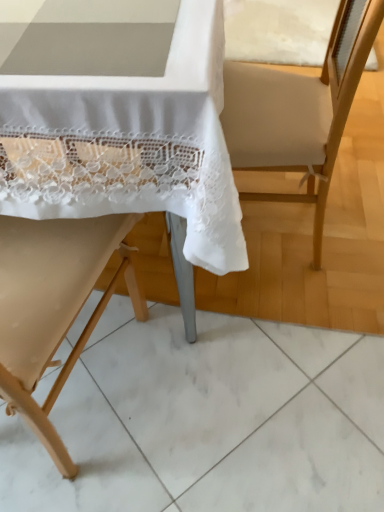
Question: Does beige fabric chair at left, the second chair in the top-to-bottom sequence, have a greater height compared to beige fabric armchair at center?

Choices:
 (A) no
 (B) yes

Answer: (B)

Question: Is beige fabric chair at left, which is counted as the 1th chair, starting from the bottom, positioned behind beige fabric armchair at center?

Choices:
 (A) yes
 (B) no

Answer: (B)

Question: From the image's perspective, is beige fabric chair at left, which is counted as the 1th chair, starting from the bottom, on top of beige fabric armchair at center?

Choices:
 (A) yes
 (B) no

Answer: (B)

Question: Is beige fabric chair at left, the second chair in the top-to-bottom sequence, positioned in front of beige fabric armchair at center?

Choices:
 (A) no
 (B) yes

Answer: (B)

Question: Does beige fabric chair at left, the second chair in the top-to-bottom sequence, have a greater width compared to beige fabric armchair at center?

Choices:
 (A) yes
 (B) no

Answer: (A)

Question: Is beige fabric chair at left, which is counted as the 1th chair, starting from the bottom, completely or partially outside of beige fabric armchair at center?

Choices:
 (A) no
 (B) yes

Answer: (B)

Question: From the image's perspective, is beige wood chair at center, which appears as the 1th chair when viewed from the top, located above beige fabric armchair at center?

Choices:
 (A) no
 (B) yes

Answer: (B)

Question: From a real-world perspective, is beige wood chair at center, positioned as the second chair in bottom-to-top order, positioned over beige fabric armchair at center based on gravity?

Choices:
 (A) no
 (B) yes

Answer: (B)

Question: Is beige wood chair at center, positioned as the second chair in bottom-to-top order, further to the viewer compared to beige fabric armchair at center?

Choices:
 (A) no
 (B) yes

Answer: (A)

Question: From a real-world perspective, is beige wood chair at center, which appears as the 1th chair when viewed from the top, beneath beige fabric armchair at center?

Choices:
 (A) yes
 (B) no

Answer: (B)

Question: Is beige wood chair at center, positioned as the second chair in bottom-to-top order, thinner than beige fabric armchair at center?

Choices:
 (A) yes
 (B) no

Answer: (B)

Question: Can you confirm if beige wood chair at center, which appears as the 1th chair when viewed from the top, is positioned to the left of beige fabric armchair at center?

Choices:
 (A) yes
 (B) no

Answer: (A)

Question: From the image's perspective, does beige fabric chair at left, the second chair in the top-to-bottom sequence, appear higher than beige wood chair at center, positioned as the second chair in bottom-to-top order?

Choices:
 (A) yes
 (B) no

Answer: (B)